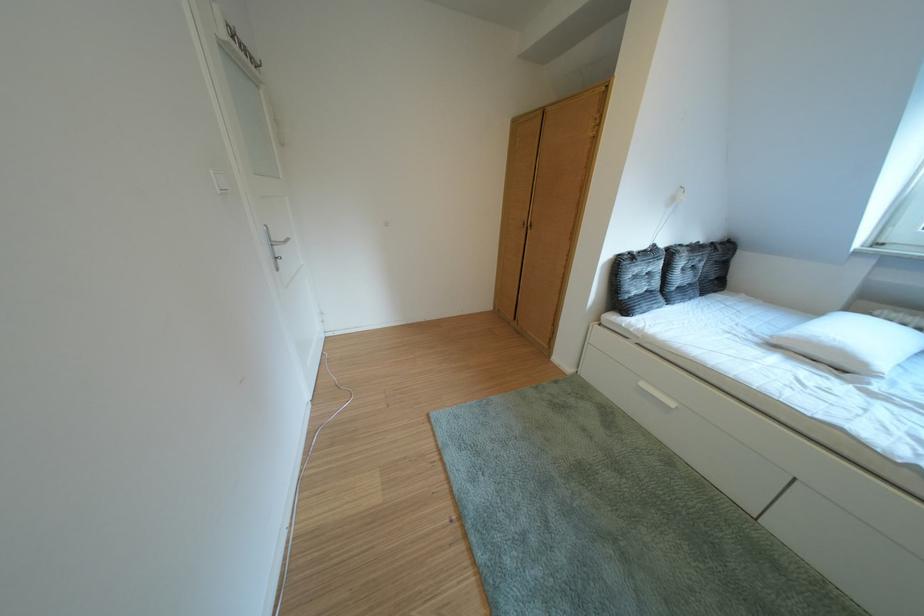
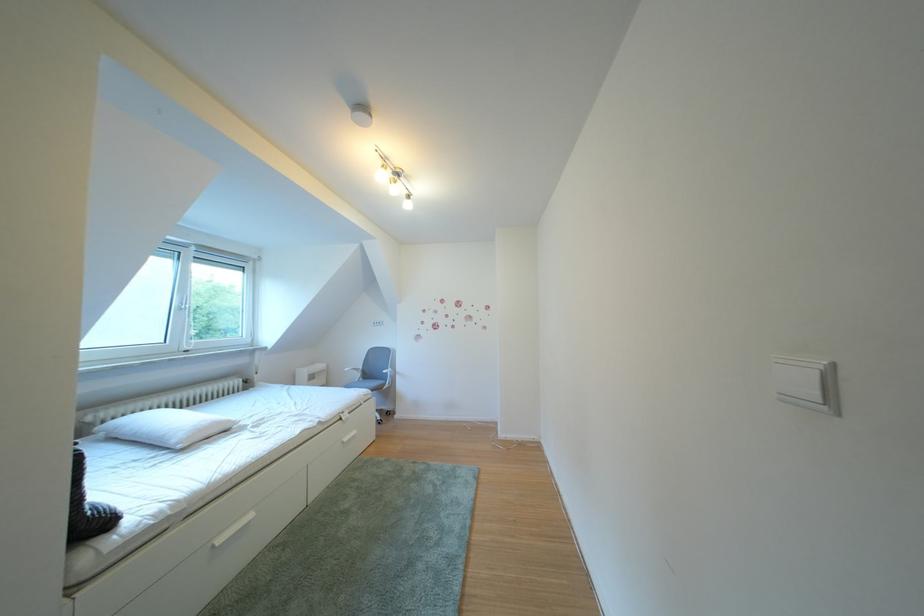
Find the pixel in the second image that matches (x=892, y=318) in the first image.

(103, 424)